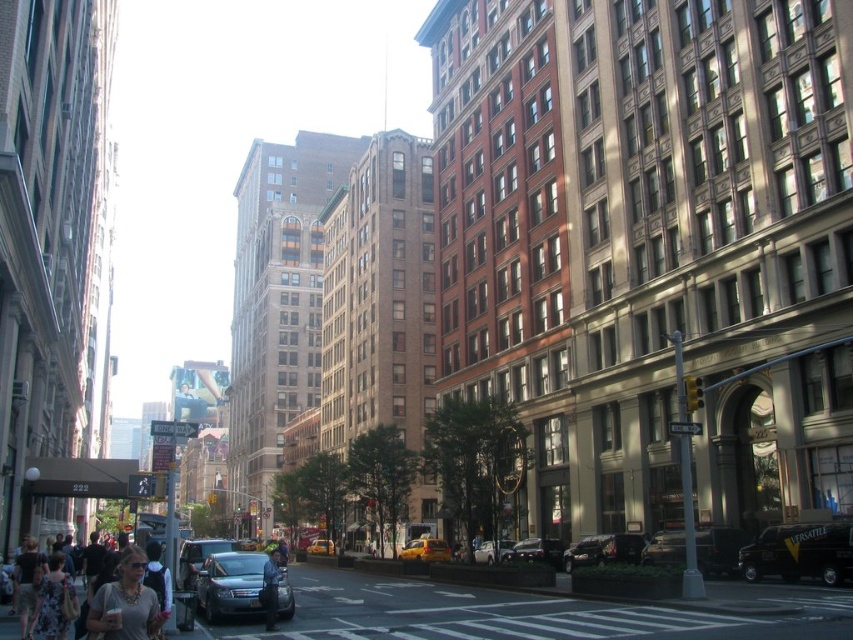
Question: Which point is closer to the camera?

Choices:
 (A) (816, 561)
 (B) (123, 620)

Answer: (B)

Question: Does matte silver sedan at center have a larger size compared to metallic silver car at center?

Choices:
 (A) no
 (B) yes

Answer: (B)

Question: Which object is closer to the camera taking this photo?

Choices:
 (A) black matte suv at center
 (B) yellow rubber taxi at center
 (C) matte gray sweater at lower left

Answer: (C)

Question: Based on their relative distances, which object is farther from the shiny black sedan at center?

Choices:
 (A) matte blue sedan at center
 (B) matte gray jacket at center
 (C) metallic silver car at center
 (D) black matte suv at center

Answer: (B)

Question: Does black matte suv at center have a smaller size compared to dark gray sweater at lower left?

Choices:
 (A) yes
 (B) no

Answer: (A)

Question: Considering the relative positions of matte gray jacket at center and yellow rubber taxi at center in the image provided, where is matte gray jacket at center located with respect to yellow rubber taxi at center?

Choices:
 (A) above
 (B) below

Answer: (B)